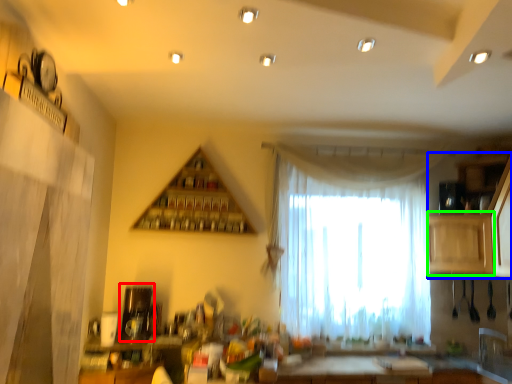
Question: Which object is the closest to the appliance (highlighted by a red box)? Choose among these: cabinetry (highlighted by a blue box) or cabinetry (highlighted by a green box).

Choices:
 (A) cabinetry
 (B) cabinetry

Answer: (B)